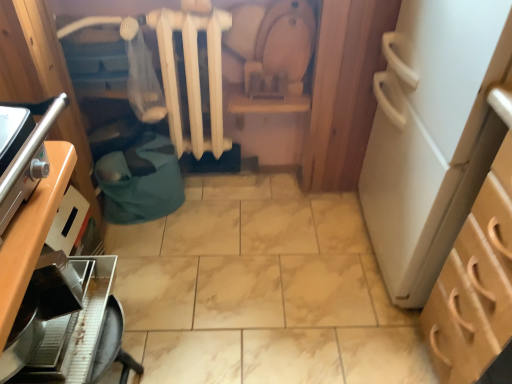
Question: Is metallic silver coffee maker at lower left to the left of white matte radiator at center from the viewer's perspective?

Choices:
 (A) yes
 (B) no

Answer: (A)

Question: Considering the relative sizes of metallic silver coffee maker at lower left and white matte radiator at center in the image provided, is metallic silver coffee maker at lower left taller than white matte radiator at center?

Choices:
 (A) yes
 (B) no

Answer: (B)

Question: From the image's perspective, is metallic silver coffee maker at lower left below white matte radiator at center?

Choices:
 (A) yes
 (B) no

Answer: (A)

Question: Does metallic silver coffee maker at lower left come in front of white matte radiator at center?

Choices:
 (A) no
 (B) yes

Answer: (B)

Question: Is metallic silver coffee maker at lower left wider than white matte radiator at center?

Choices:
 (A) yes
 (B) no

Answer: (A)

Question: Relative to light brown wood cabinet at right, the second cabinetry viewed from the left, is wooden cabinet at left, marked as the first cabinetry in a left-to-right arrangement, in front or behind?

Choices:
 (A) behind
 (B) front

Answer: (B)

Question: In terms of width, does wooden cabinet at left, the second cabinetry viewed from the right, look wider or thinner when compared to light brown wood cabinet at right, the second cabinetry viewed from the left?

Choices:
 (A) thin
 (B) wide

Answer: (A)

Question: Looking at the image, does wooden cabinet at left, the second cabinetry viewed from the right, seem bigger or smaller compared to light brown wood cabinet at right, the second cabinetry viewed from the left?

Choices:
 (A) small
 (B) big

Answer: (A)

Question: From a real-world perspective, relative to light brown wood cabinet at right, the second cabinetry viewed from the left, is wooden cabinet at left, marked as the first cabinetry in a left-to-right arrangement, vertically above or below?

Choices:
 (A) above
 (B) below

Answer: (A)

Question: From the image's perspective, is light brown wood cabinet at right, the second cabinetry viewed from the left, located above or below white matte radiator at center?

Choices:
 (A) above
 (B) below

Answer: (B)

Question: In terms of size, does light brown wood cabinet at right, which is counted as the first cabinetry, starting from the right, appear bigger or smaller than white matte radiator at center?

Choices:
 (A) big
 (B) small

Answer: (A)

Question: Would you say light brown wood cabinet at right, the second cabinetry viewed from the left, is to the left or to the right of white matte radiator at center in the picture?

Choices:
 (A) left
 (B) right

Answer: (B)

Question: From a real-world perspective, is light brown wood cabinet at right, the second cabinetry viewed from the left, above or below white matte radiator at center?

Choices:
 (A) below
 (B) above

Answer: (A)

Question: From their relative heights in the image, would you say light brown wood cabinet at right, which is counted as the first cabinetry, starting from the right, is taller or shorter than wooden cabinet at left, marked as the first cabinetry in a left-to-right arrangement?

Choices:
 (A) short
 (B) tall

Answer: (B)

Question: Choose the correct answer: Is light brown wood cabinet at right, which is counted as the first cabinetry, starting from the right, inside wooden cabinet at left, the second cabinetry viewed from the right, or outside it?

Choices:
 (A) outside
 (B) inside

Answer: (A)